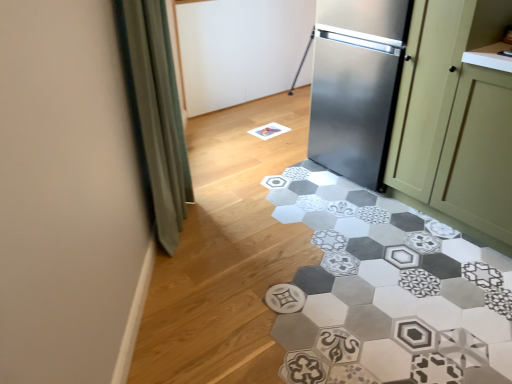
What do you see at coordinates (388, 292) in the screenshot? I see `gray hexagonal tile at center` at bounding box center [388, 292].

What are the coordinates of `green fabric curtain at left` in the screenshot? It's located at (155, 114).

Could you tell me if green fabric curtain at left is facing gray hexagonal tile at center?

Yes, green fabric curtain at left is turned towards gray hexagonal tile at center.

Is green fabric curtain at left positioned behind gray hexagonal tile at center?

Yes.

What's the angular difference between green fabric curtain at left and gray hexagonal tile at center's facing directions?

The facing directions of green fabric curtain at left and gray hexagonal tile at center are 144 degrees apart.

You are a GUI agent. You are given a task and a screenshot of the screen. Output one action in this format:
    pyautogui.click(x=<x>, y=<y>)
    Task: Click on the curtain lying behind the gray hexagonal tile at center
    
    Given the screenshot: What is the action you would take?
    pyautogui.click(x=155, y=114)

Which object is positioned more to the left, gray hexagonal tile at center or green matte cabinet at right?

gray hexagonal tile at center.

Considering the sizes of objects gray hexagonal tile at center and green matte cabinet at right in the image provided, who is wider, gray hexagonal tile at center or green matte cabinet at right?

gray hexagonal tile at center is wider.

Is gray hexagonal tile at center located outside green matte cabinet at right?

Absolutely, gray hexagonal tile at center is external to green matte cabinet at right.

This screenshot has width=512, height=384. What are the coordinates of `glass door that is below the stainless steel cabinet at right (from the image's perspective)` in the screenshot? It's located at (478, 153).

How distant is stainless steel cabinet at right from green matte cabinet at right?

stainless steel cabinet at right is 2.60 inches from green matte cabinet at right.

From a real-world perspective, is stainless steel cabinet at right above or below green matte cabinet at right?

In terms of real-world spatial position, stainless steel cabinet at right is above green matte cabinet at right.

Is stainless steel cabinet at right aimed at green matte cabinet at right?

No, stainless steel cabinet at right is not turned towards green matte cabinet at right.

Based on the photo, which object is positioned more to the left, stainless steel cabinet at right or green fabric curtain at left?

green fabric curtain at left.

Can you tell me how much stainless steel cabinet at right and green fabric curtain at left differ in facing direction?

The angular difference between stainless steel cabinet at right and green fabric curtain at left is 144 degrees.

Does point (420, 192) come farther from viewer compared to point (179, 135)?

Yes, it is.

Find the location of a particular element. The width and height of the screenshot is (512, 384). cabinetry below the green fabric curtain at left (from a real-world perspective) is located at coordinates (456, 118).

Is green fabric curtain at left placed right next to stainless steel cabinet at right?

green fabric curtain at left and stainless steel cabinet at right are not in contact.

Between green fabric curtain at left and stainless steel cabinet at right, which one has larger width?

stainless steel cabinet at right is wider.

Considering their positions, is green fabric curtain at left located in front of or behind stainless steel cabinet at right?

Visually, green fabric curtain at left is located in front of stainless steel cabinet at right.

Is green fabric curtain at left looking in the opposite direction of stainless steel cabinet at right?

That's not correct — green fabric curtain at left is not looking away from stainless steel cabinet at right.

Would you say gray hexagonal tile at center is to the left or to the right of green fabric curtain at left in the picture?

In the image, gray hexagonal tile at center appears on the right side of green fabric curtain at left.

Does gray hexagonal tile at center come in front of green fabric curtain at left?

Yes, the depth of gray hexagonal tile at center is less than that of green fabric curtain at left.

Is gray hexagonal tile at center oriented away from green fabric curtain at left?

No, green fabric curtain at left is not at the back of gray hexagonal tile at center.

From the image's perspective, is gray hexagonal tile at center above or below green fabric curtain at left?

gray hexagonal tile at center is below green fabric curtain at left.

Is green matte cabinet at right positioned with its back to stainless steel cabinet at right?

No, green matte cabinet at right is not facing away from stainless steel cabinet at right.

From the picture: Who is taller, green matte cabinet at right or stainless steel cabinet at right?

stainless steel cabinet at right.

From the image's perspective, is green matte cabinet at right on top of stainless steel cabinet at right?

No, from the image's perspective, green matte cabinet at right is not above stainless steel cabinet at right.

Where is `curtain above the gray hexagonal tile at center (from the image's perspective)`? curtain above the gray hexagonal tile at center (from the image's perspective) is located at coordinates (155, 114).

The image size is (512, 384). I want to click on marble directly beneath the green matte cabinet at right (from a real-world perspective), so click(388, 292).

Estimate the real-world distances between objects in this image. Which object is further from green matte cabinet at right, green fabric curtain at left or gray hexagonal tile at center?

Based on the image, green fabric curtain at left appears to be further to green matte cabinet at right.

Estimate the real-world distances between objects in this image. Which object is further from gray hexagonal tile at center, green fabric curtain at left or stainless steel cabinet at right?

green fabric curtain at left lies further to gray hexagonal tile at center than the other object.

Estimate the real-world distances between objects in this image. Which object is further from green fabric curtain at left, stainless steel cabinet at right or gray hexagonal tile at center?

Based on the image, stainless steel cabinet at right appears to be further to green fabric curtain at left.

From the image, which object appears to be nearer to green matte cabinet at right, green fabric curtain at left or stainless steel cabinet at right?

stainless steel cabinet at right.

When comparing their distances from stainless steel cabinet at right, does green matte cabinet at right or gray hexagonal tile at center seem closer?

green matte cabinet at right lies closer to stainless steel cabinet at right than the other object.

Estimate the real-world distances between objects in this image. Which object is further from gray hexagonal tile at center, green fabric curtain at left or green matte cabinet at right?

green fabric curtain at left.

When comparing their distances from green matte cabinet at right, does gray hexagonal tile at center or green fabric curtain at left seem closer?

gray hexagonal tile at center.

Which object lies nearer to the anchor point stainless steel cabinet at right, green fabric curtain at left or green matte cabinet at right?

Among the two, green matte cabinet at right is located nearer to stainless steel cabinet at right.

The image size is (512, 384). I want to click on cabinetry situated between gray hexagonal tile at center and green matte cabinet at right from left to right, so click(456, 118).

What are the coordinates of `cabinetry between green fabric curtain at left and green matte cabinet at right from left to right` in the screenshot? It's located at (456, 118).

In order to click on marble situated between green fabric curtain at left and stainless steel cabinet at right from left to right in this screenshot , I will do `click(388, 292)`.

The width and height of the screenshot is (512, 384). Find the location of `marble between green fabric curtain at left and green matte cabinet at right`. marble between green fabric curtain at left and green matte cabinet at right is located at coordinates (388, 292).